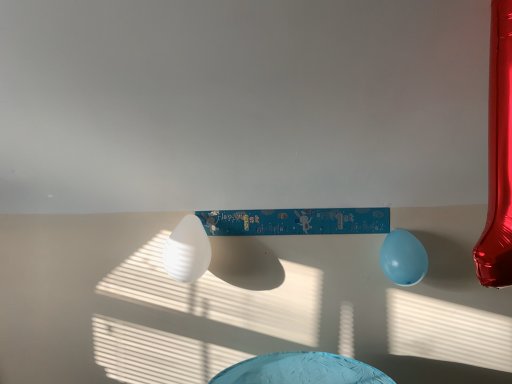
Question: Is white matte balloon at center, marked as the 1th balloon in a left-to-right arrangement, bigger or smaller than light blue rubber balloon at lower right, the 1th balloon when ordered from right to left?

Choices:
 (A) big
 (B) small

Answer: (A)

Question: In terms of height, does white matte balloon at center, marked as the 1th balloon in a left-to-right arrangement, look taller or shorter compared to light blue rubber balloon at lower right, the 1th balloon when ordered from right to left?

Choices:
 (A) tall
 (B) short

Answer: (A)

Question: Considering their positions, is white matte balloon at center, marked as the 1th balloon in a left-to-right arrangement, located in front of or behind light blue rubber balloon at lower right, the 2th balloon viewed from the left?

Choices:
 (A) front
 (B) behind

Answer: (A)

Question: Considering the relative positions of light blue rubber balloon at lower right, the 2th balloon viewed from the left, and white matte balloon at center, marked as the 1th balloon in a left-to-right arrangement, in the image provided, is light blue rubber balloon at lower right, the 2th balloon viewed from the left, to the left or to the right of white matte balloon at center, marked as the 1th balloon in a left-to-right arrangement,?

Choices:
 (A) right
 (B) left

Answer: (A)

Question: Considering the positions of light blue rubber balloon at lower right, the 2th balloon viewed from the left, and white matte balloon at center, the second balloon from the right, in the image, is light blue rubber balloon at lower right, the 2th balloon viewed from the left, wider or thinner than white matte balloon at center, the second balloon from the right,?

Choices:
 (A) wide
 (B) thin

Answer: (B)

Question: Is point (399, 238) closer or farther from the camera than point (182, 279)?

Choices:
 (A) closer
 (B) farther

Answer: (B)

Question: Considering their positions, is light blue rubber balloon at lower right, the 1th balloon when ordered from right to left, located in front of or behind white matte balloon at center, marked as the 1th balloon in a left-to-right arrangement?

Choices:
 (A) behind
 (B) front

Answer: (A)